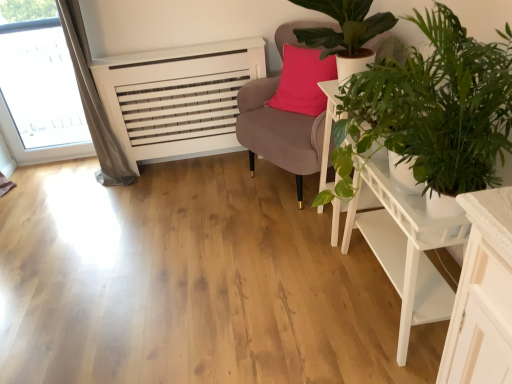
Question: Can you confirm if velvet pink chair at upper right is taller than white wooden side table at center right?

Choices:
 (A) yes
 (B) no

Answer: (A)

Question: From a real-world perspective, is velvet pink chair at upper right over white wooden side table at center right?

Choices:
 (A) yes
 (B) no

Answer: (A)

Question: From the image's perspective, is velvet pink chair at upper right under white wooden side table at center right?

Choices:
 (A) yes
 (B) no

Answer: (B)

Question: Is white wooden side table at center right completely or partially inside velvet pink chair at upper right?

Choices:
 (A) no
 (B) yes

Answer: (A)

Question: Is the surface of velvet pink chair at upper right in direct contact with white wooden side table at center right?

Choices:
 (A) yes
 (B) no

Answer: (B)

Question: Is green leafy plant at right, positioned as the 1th houseplant in front-to-back order, situated inside white wooden side table at center right or outside?

Choices:
 (A) inside
 (B) outside

Answer: (B)

Question: Considering the relative positions of green leafy plant at right, positioned as the 1th houseplant in front-to-back order, and white wooden side table at center right in the image provided, is green leafy plant at right, positioned as the 1th houseplant in front-to-back order, to the left or to the right of white wooden side table at center right?

Choices:
 (A) left
 (B) right

Answer: (A)

Question: From the image's perspective, is green leafy plant at right, positioned as the 1th houseplant in front-to-back order, above or below white wooden side table at center right?

Choices:
 (A) below
 (B) above

Answer: (A)

Question: From a real-world perspective, is green leafy plant at right, positioned as the 1th houseplant in front-to-back order, above or below white wooden side table at center right?

Choices:
 (A) above
 (B) below

Answer: (A)

Question: From a real-world perspective, is white wooden side table at center right positioned above or below white wooden table at lower right?

Choices:
 (A) above
 (B) below

Answer: (A)

Question: Based on their sizes in the image, would you say white wooden side table at center right is bigger or smaller than white wooden table at lower right?

Choices:
 (A) small
 (B) big

Answer: (A)

Question: Is point (324, 87) positioned closer to the camera than point (376, 236)?

Choices:
 (A) closer
 (B) farther

Answer: (B)

Question: Would you say white wooden side table at center right is inside or outside white wooden table at lower right?

Choices:
 (A) outside
 (B) inside

Answer: (A)

Question: Relative to white wooden side table at center right, is white wooden table at lower right in front or behind?

Choices:
 (A) front
 (B) behind

Answer: (A)

Question: Is point (374, 220) positioned closer to the camera than point (322, 175)?

Choices:
 (A) farther
 (B) closer

Answer: (B)